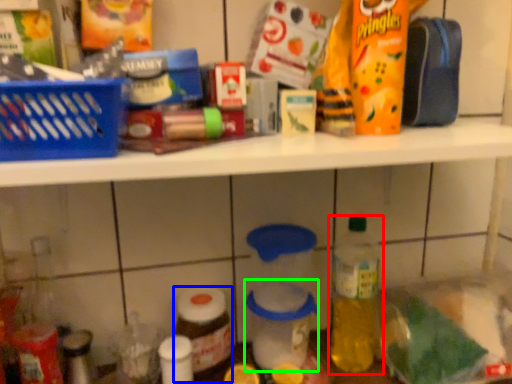
Question: Which object is positioned closest to bottle (highlighted by a red box)? Select from bottle (highlighted by a blue box) and glass jar (highlighted by a green box).

Choices:
 (A) bottle
 (B) glass jar

Answer: (B)